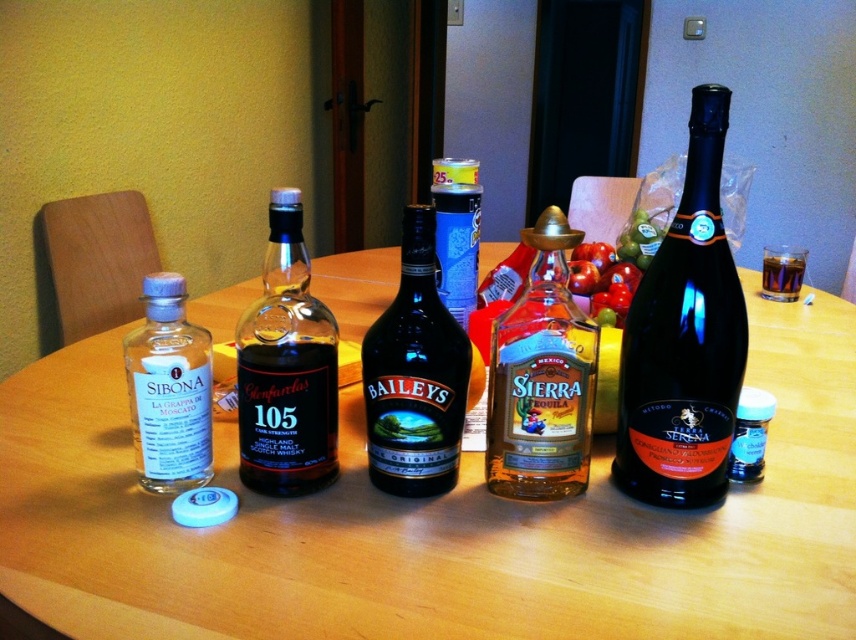
Which is behind, point (560, 456) or point (333, 371)?

Positioned behind is point (333, 371).

Which is in front, point (535, 436) or point (324, 440)?

Point (535, 436)

The width and height of the screenshot is (856, 640). In order to click on translucent glass tequila at center in this screenshot , I will do `click(541, 378)`.

Is dark glass bottle at center bigger than translucent glass bottle at left?

Correct, dark glass bottle at center is larger in size than translucent glass bottle at left.

Who is positioned more to the right, dark glass bottle at center or translucent glass bottle at left?

From the viewer's perspective, dark glass bottle at center appears more on the right side.

Measure the distance between dark glass bottle at center and camera.

dark glass bottle at center is 56.72 centimeters away from camera.

Identify the location of dark glass bottle at center. (415, 374).

Does point (450, 472) lie in front of point (788, 291)?

Yes, point (450, 472) is in front of point (788, 291).

Which is in front, point (409, 320) or point (797, 253)?

Point (409, 320) is more forward.

Identify the location of dark glass bottle at center. (415, 374).